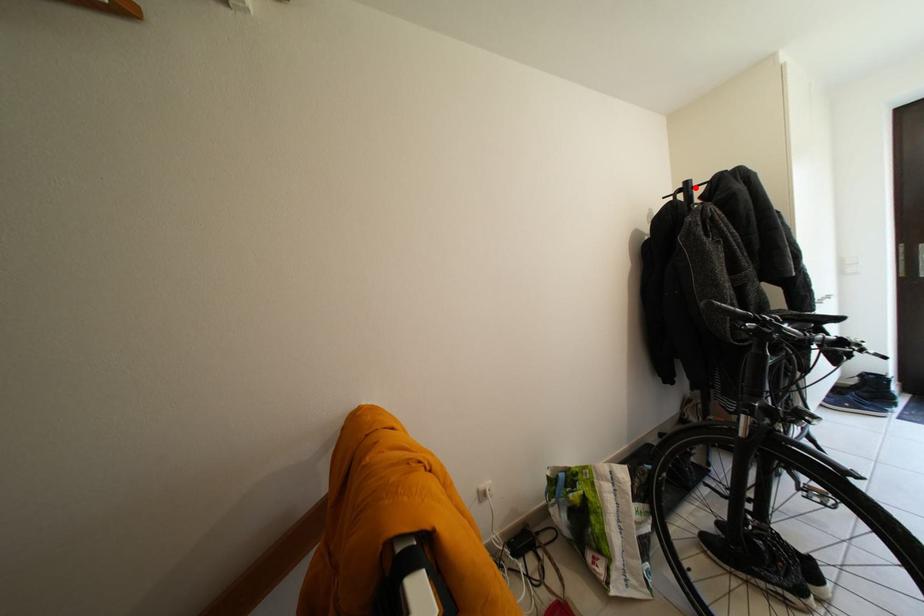
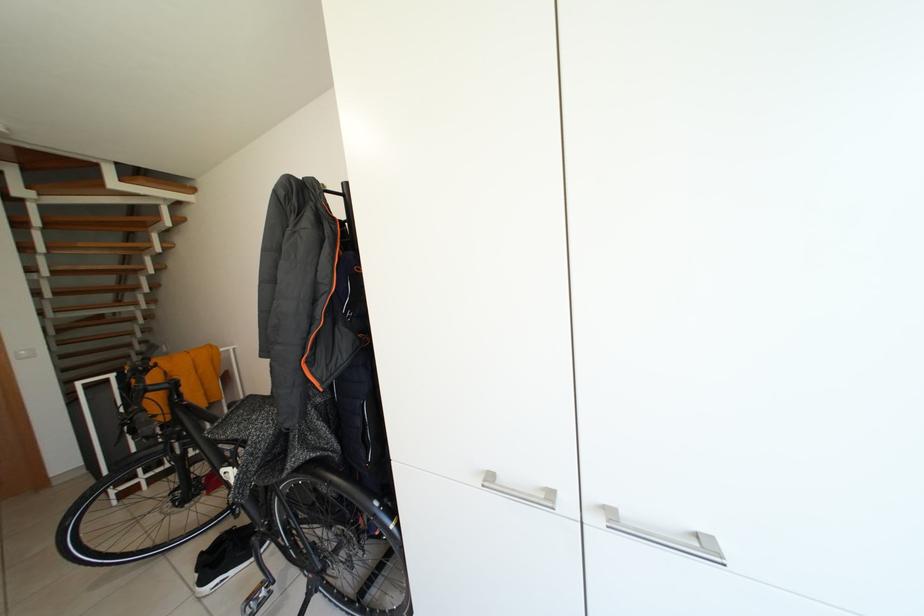
Question: I am providing you with two images of the same scene from different viewpoints. A red point is marked on the first image. Is the red point's position out of view in image 2?

Choices:
 (A) Yes
 (B) No

Answer: (A)